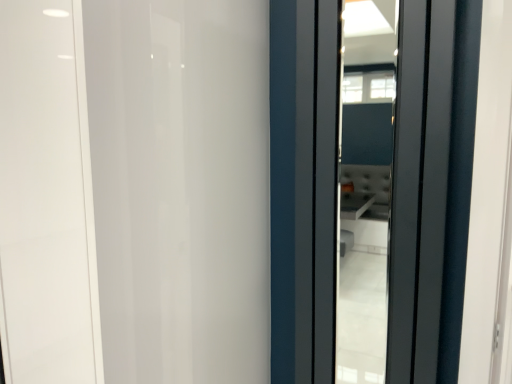
This screenshot has height=384, width=512. What do you see at coordinates (180, 187) in the screenshot?
I see `glossy white screen door at left` at bounding box center [180, 187].

Identify the location of glossy white screen door at left. The image size is (512, 384). (180, 187).

At what (x,y) coordinates should I click in order to perform the action: click on glossy white screen door at left. Please return your answer as a coordinate pair (x, y). This screenshot has width=512, height=384. Looking at the image, I should click on (180, 187).